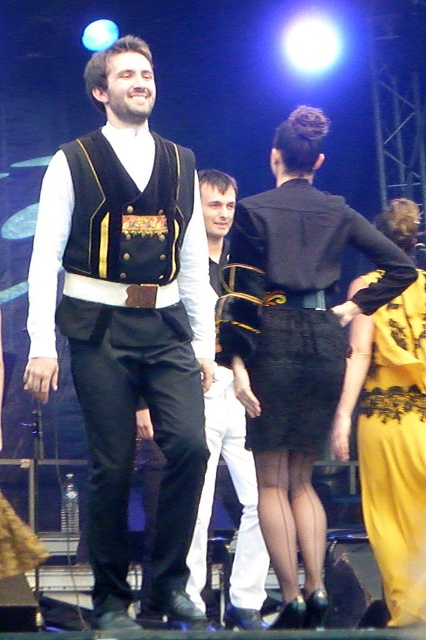
Based on the photo, you are an audience member sitting in the front row of the stage. You notice two items at the center of the stage, the matte black vest at center and the black lace skirt at center. Which one appears taller from your viewpoint?

The matte black vest at center is taller than the black lace skirt at center from your viewpoint.

You are standing on stage and see a point marked at coordinates (127,387). According to the scene description, what object is this point located on?

The point at coordinates (127,387) is located on the matte black vest at center.

You are a stagehand observing the performers on stage. You notice the matte black vest at center and the white cotton pants at center. Which one is positioned higher in the image?

The matte black vest at center is located above the white cotton pants at center, so it is positioned higher in the image.